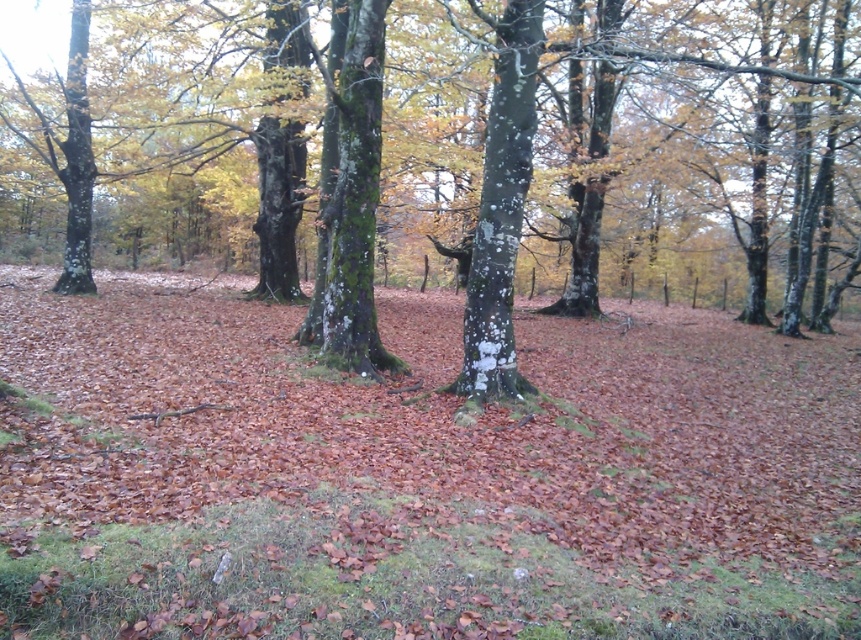
Question: Which point is farther to the camera?

Choices:
 (A) (84, 68)
 (B) (486, 188)

Answer: (A)

Question: Among these points, which one is nearest to the camera?

Choices:
 (A) (500, 308)
 (B) (333, 120)

Answer: (A)

Question: Where is white lichen-covered tree trunk at center located in relation to smooth bark tree trunk at left in the image?

Choices:
 (A) right
 (B) left

Answer: (A)

Question: Which of the following is the farthest from the observer?

Choices:
 (A) (366, 83)
 (B) (356, 152)
 (C) (72, 164)

Answer: (C)

Question: Where is white lichen-covered tree trunk at center located in relation to smooth bark tree trunk at left in the image?

Choices:
 (A) right
 (B) left

Answer: (A)

Question: Does brown matte leaves at center appear on the left side of green mossy tree at center?

Choices:
 (A) no
 (B) yes

Answer: (B)